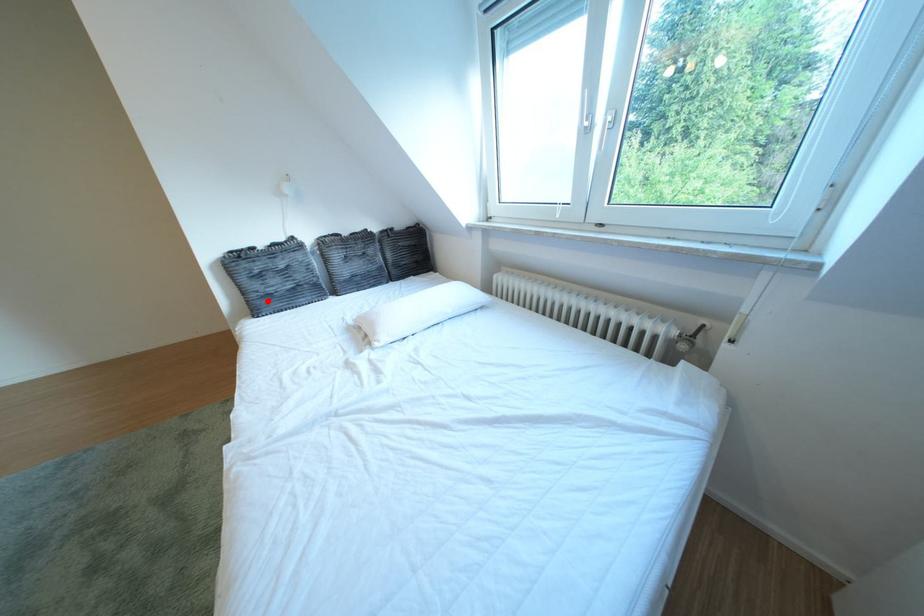
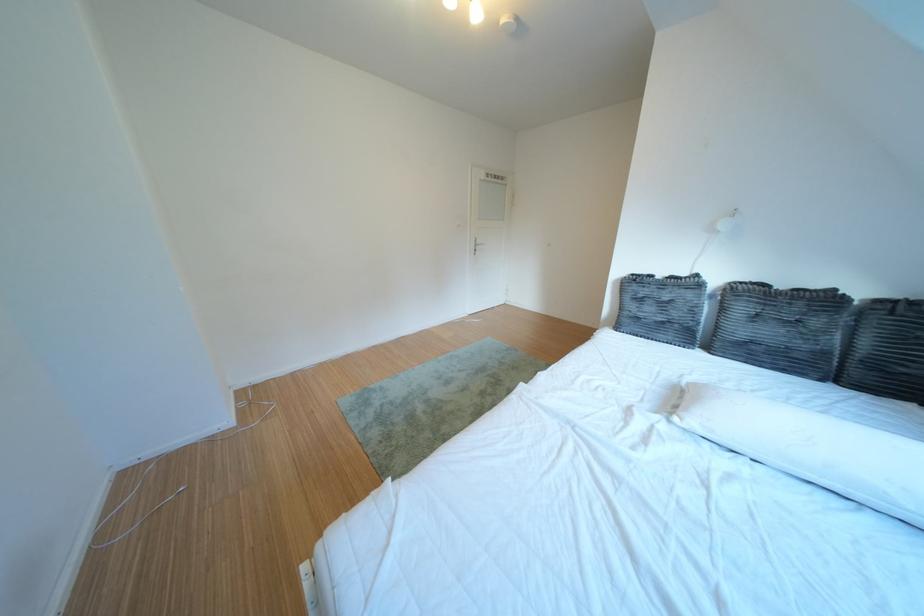
Where in the second image is the point corresponding to the highlighted location from the first image?

(639, 318)